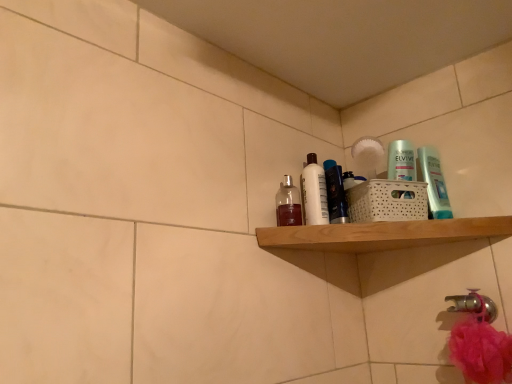
Question: Does shiny black bottle at center, which is the 2th toiletry in right-to-left order, appear on the right side of translucent glass bottle at upper center, the 4th toiletry positioned from the right?

Choices:
 (A) yes
 (B) no

Answer: (A)

Question: Does shiny black bottle at center, which is the 2th toiletry in right-to-left order, have a greater width compared to translucent glass bottle at upper center, the 4th toiletry positioned from the right?

Choices:
 (A) yes
 (B) no

Answer: (A)

Question: From the image's perspective, does shiny black bottle at center, which is the third toiletry in left-to-right order, appear higher than translucent glass bottle at upper center, the 4th toiletry positioned from the right?

Choices:
 (A) no
 (B) yes

Answer: (B)

Question: Considering the relative sizes of shiny black bottle at center, which is the third toiletry in left-to-right order, and translucent glass bottle at upper center, placed as the first toiletry when sorted from left to right, in the image provided, is shiny black bottle at center, which is the third toiletry in left-to-right order, thinner than translucent glass bottle at upper center, placed as the first toiletry when sorted from left to right,?

Choices:
 (A) no
 (B) yes

Answer: (A)

Question: Is shiny black bottle at center, which is the third toiletry in left-to-right order, outside translucent glass bottle at upper center, placed as the first toiletry when sorted from left to right?

Choices:
 (A) yes
 (B) no

Answer: (A)

Question: Considering the relative positions of gold metallic faucet at lower right and wooden shelf at upper right in the image provided, is gold metallic faucet at lower right to the left or to the right of wooden shelf at upper right?

Choices:
 (A) left
 (B) right

Answer: (B)

Question: In terms of width, does gold metallic faucet at lower right look wider or thinner when compared to wooden shelf at upper right?

Choices:
 (A) thin
 (B) wide

Answer: (A)

Question: From the image's perspective, relative to wooden shelf at upper right, is gold metallic faucet at lower right above or below?

Choices:
 (A) below
 (B) above

Answer: (A)

Question: Considering the positions of point (475, 306) and point (331, 241), is point (475, 306) closer or farther from the camera than point (331, 241)?

Choices:
 (A) farther
 (B) closer

Answer: (B)

Question: Considering the positions of translucent glass bottle at upper center, placed as the first toiletry when sorted from left to right, and translucent plastic bottle at upper right, the 1th toiletry when ordered from right to left, in the image, is translucent glass bottle at upper center, placed as the first toiletry when sorted from left to right, wider or thinner than translucent plastic bottle at upper right, the 1th toiletry when ordered from right to left,?

Choices:
 (A) wide
 (B) thin

Answer: (A)

Question: Does point (284, 177) appear closer or farther from the camera than point (439, 195)?

Choices:
 (A) closer
 (B) farther

Answer: (B)

Question: From the image's perspective, is translucent glass bottle at upper center, placed as the first toiletry when sorted from left to right, above or below translucent plastic bottle at upper right, the 1th toiletry when ordered from right to left?

Choices:
 (A) below
 (B) above

Answer: (A)

Question: From a real-world perspective, relative to translucent plastic bottle at upper right, which is counted as the 4th toiletry, starting from the left, is translucent glass bottle at upper center, the 4th toiletry positioned from the right, vertically above or below?

Choices:
 (A) above
 (B) below

Answer: (B)

Question: Is shiny black bottle at center, which is the third toiletry in left-to-right order, in front of or behind wooden shelf at upper right in the image?

Choices:
 (A) front
 (B) behind

Answer: (B)

Question: Considering the positions of point 342,190 and point 507,233, is point 342,190 closer or farther from the camera than point 507,233?

Choices:
 (A) farther
 (B) closer

Answer: (A)